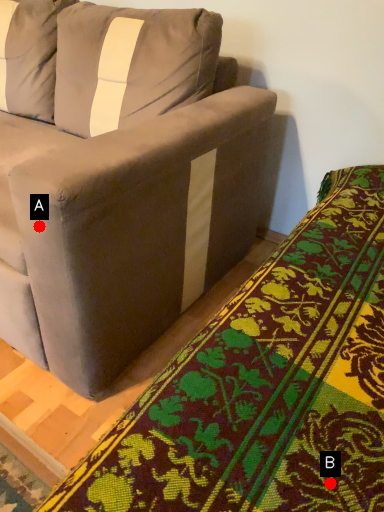
Question: Two points are circled on the image, labeled by A and B beside each circle. Which of the following is the closest to the observer?

Choices:
 (A) A is closer
 (B) B is closer

Answer: (B)